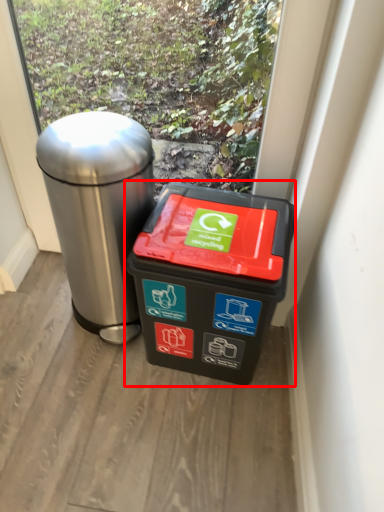
Question: Considering the relative positions of waste container (annotated by the red box) and waste container in the image provided, where is waste container (annotated by the red box) located with respect to the staircase?

Choices:
 (A) right
 (B) left

Answer: (A)